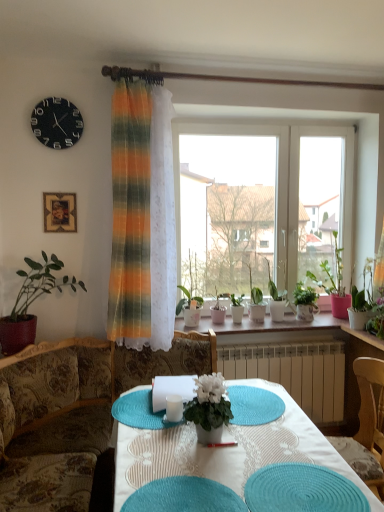
The height and width of the screenshot is (512, 384). In order to click on vacant space situated above blue woven placemat at center (from a real-world perspective) in this screenshot , I will do `click(255, 398)`.